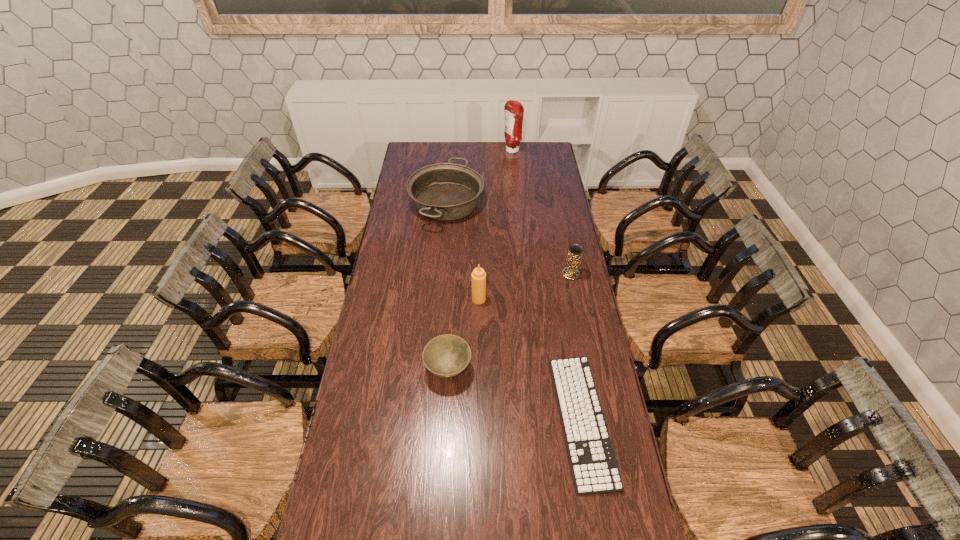
Find the location of a particular element. vacant space in between the chalice and the computer keyboard is located at coordinates (576, 347).

This screenshot has height=540, width=960. I want to click on free area in between the third object from right to left and the bowl, so click(x=480, y=260).

The image size is (960, 540). I want to click on object that can be found as the fifth closest to the right condiment, so coord(594,469).

The height and width of the screenshot is (540, 960). I want to click on object that is the third closest to the shortest object, so click(x=575, y=250).

Locate an element on the screen. The height and width of the screenshot is (540, 960). free location that satisfies the following two spatial constraints: 1. on the front side of the shortest object; 2. on the left side of the third nearest object is located at coordinates (479, 420).

Locate an element on the screen. The image size is (960, 540). free space that satisfies the following two spatial constraints: 1. on the back side of the tallest object; 2. on the left side of the bowl is located at coordinates click(461, 151).

This screenshot has height=540, width=960. Find the location of `vacant space that satisfies the following two spatial constraints: 1. on the back side of the right condiment; 2. on the left side of the second farthest object`. vacant space that satisfies the following two spatial constraints: 1. on the back side of the right condiment; 2. on the left side of the second farthest object is located at coordinates (451, 151).

Locate an element on the screen. The image size is (960, 540). free space that satisfies the following two spatial constraints: 1. on the front side of the fourth tallest object; 2. on the left side of the nearer condiment is located at coordinates (439, 299).

Locate an element on the screen. This screenshot has width=960, height=540. vacant space that satisfies the following two spatial constraints: 1. on the back side of the chalice; 2. on the left side of the fifth shortest object is located at coordinates (479, 274).